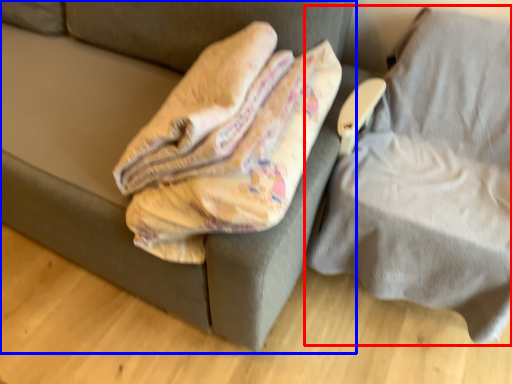
Question: Which point is closer to the camera, furniture (highlighted by a red box) or furniture (highlighted by a blue box)?

Choices:
 (A) furniture
 (B) furniture

Answer: (A)